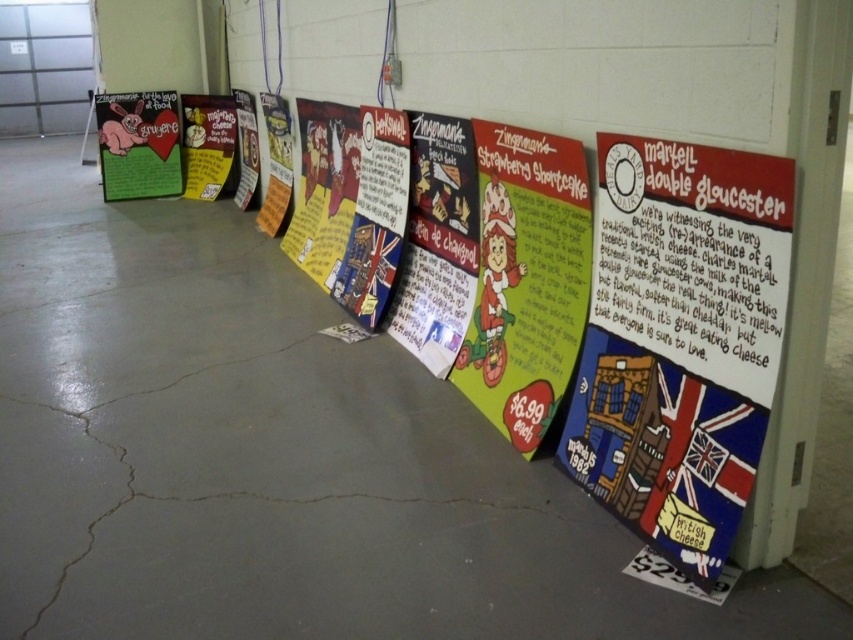
You are standing in front of the wall with the cheese posters. There are two points marked on the wall at coordinates point [598,483] and point [527,173]. Which point is closer to your current position?

Point [598,483] is closer to the viewer than point [527,173].

You are an interior designer arranging posters on a wall. You have two matte green posters to place. You want to ensure that one is positioned in the center and the other is placed higher up near the top left corner. Based on the scene provided, does the current arrangement of the matte green poster at center and the matte green poster at upper left meet your requirements?

The matte green poster at center is below the matte green poster at upper left, so yes, the current arrangement meets your requirements because the upper left poster is higher and the center poster is lower.

You are an art installer setting up a display. You have to move the matte green poster at upper left and the matte yellow poster at center. Which poster is closer to you when you are facing the wall?

The matte green poster at upper left is closer to you because it is in front of the matte yellow poster at center.